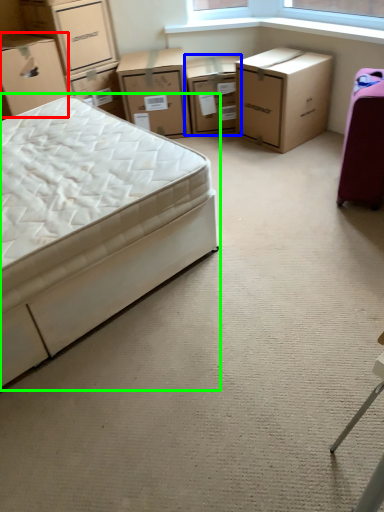
Question: Which object is positioned farthest from box (highlighted by a red box)? Select from chest of drawers (highlighted by a blue box) and bed (highlighted by a green box).

Choices:
 (A) chest of drawers
 (B) bed

Answer: (A)